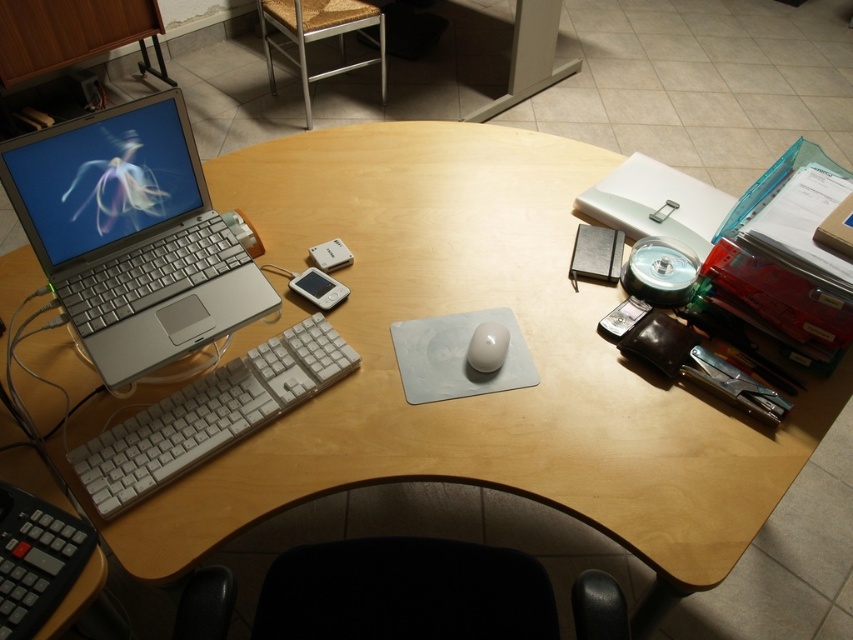
You are organizing your desk and want to place a new wireless charger between the silver metallic laptop at left and the white matte mouse at center. Based on their current positions, where should you place the charger?

The silver metallic laptop at left is to the left of the white matte mouse at center, so you should place the wireless charger between them, ensuring it is positioned to the right of the silver metallic laptop at left and to the left of the white matte mouse at center.

You are a delivery robot that needs to place a package on the desk. The package is 10 centimeters thick. The robot has to place it between the silver metallic laptop at left and the edge of the desk. Can the robot do this?

The distance of silver metallic laptop at left from camera is 90.58 centimeters. Since the package is only 10 centimeters thick, there is sufficient space between the silver metallic laptop at left and the desk edge to place it.